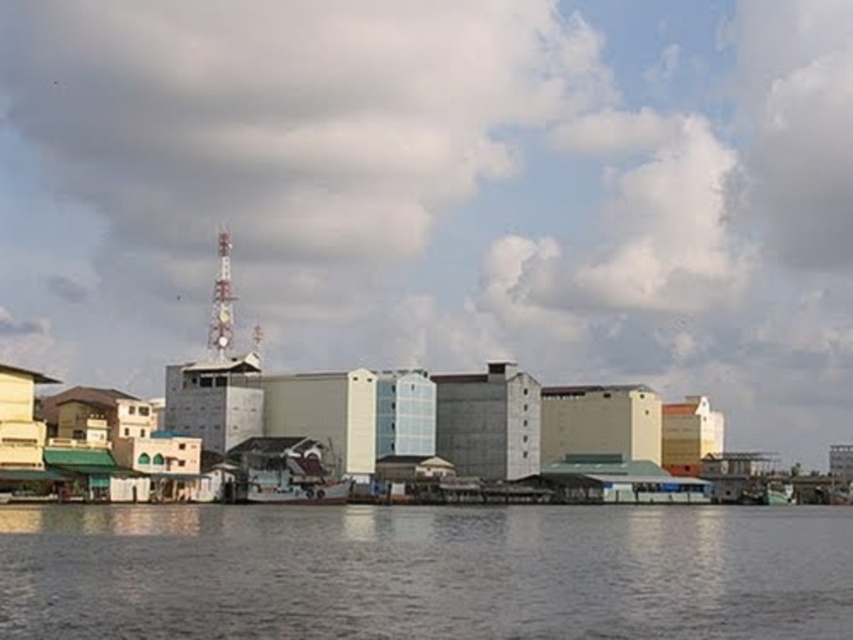
Question: Can you confirm if transparent water at lower center is smaller than white matte boat at center?

Choices:
 (A) yes
 (B) no

Answer: (B)

Question: Is the position of white fluffy cloud at upper center less distant than that of white matte boat at center?

Choices:
 (A) no
 (B) yes

Answer: (A)

Question: Which point is closer to the camera taking this photo?

Choices:
 (A) (434, 518)
 (B) (305, 492)

Answer: (A)

Question: Which point is closer to the camera taking this photo?

Choices:
 (A) (347, 492)
 (B) (463, 19)

Answer: (A)

Question: Is white fluffy cloud at upper center positioned behind transparent water at lower center?

Choices:
 (A) yes
 (B) no

Answer: (A)

Question: Considering the real-world distances, which object is closest to the white matte boat at center?

Choices:
 (A) transparent water at lower center
 (B) white fluffy cloud at upper center

Answer: (A)